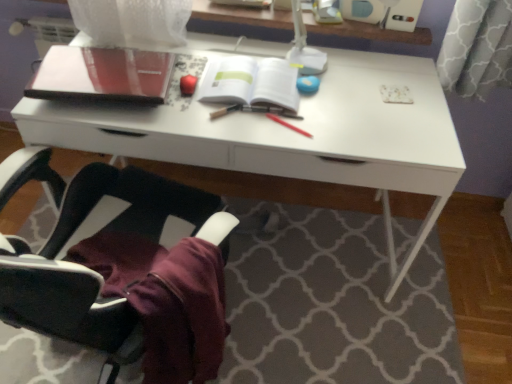
Where is `vacant area that lies in front of wooden pencil at center, the 2th stationery positioned from the left`? vacant area that lies in front of wooden pencil at center, the 2th stationery positioned from the left is located at coordinates (226, 135).